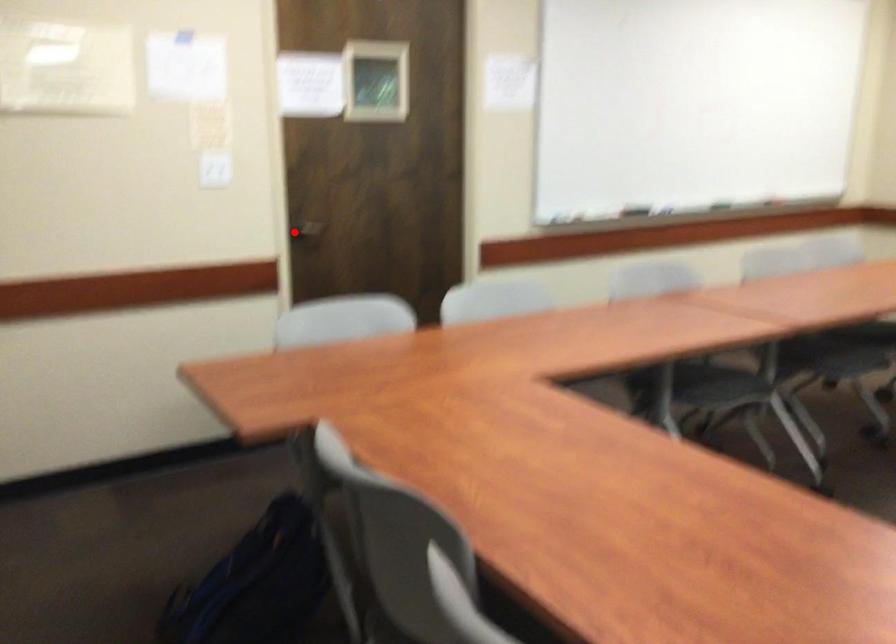
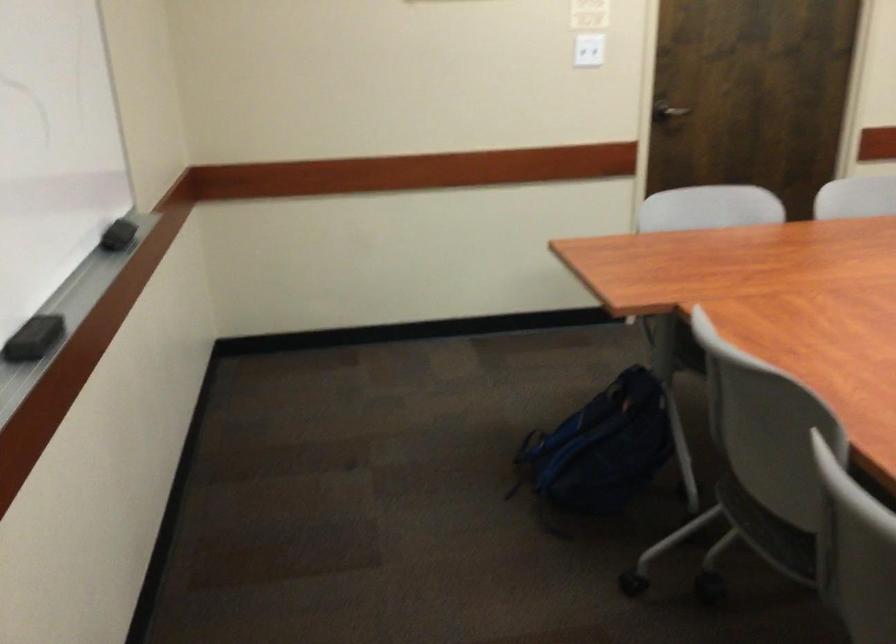
In the second image, find the point that corresponds to the highlighted location in the first image.

(667, 111)